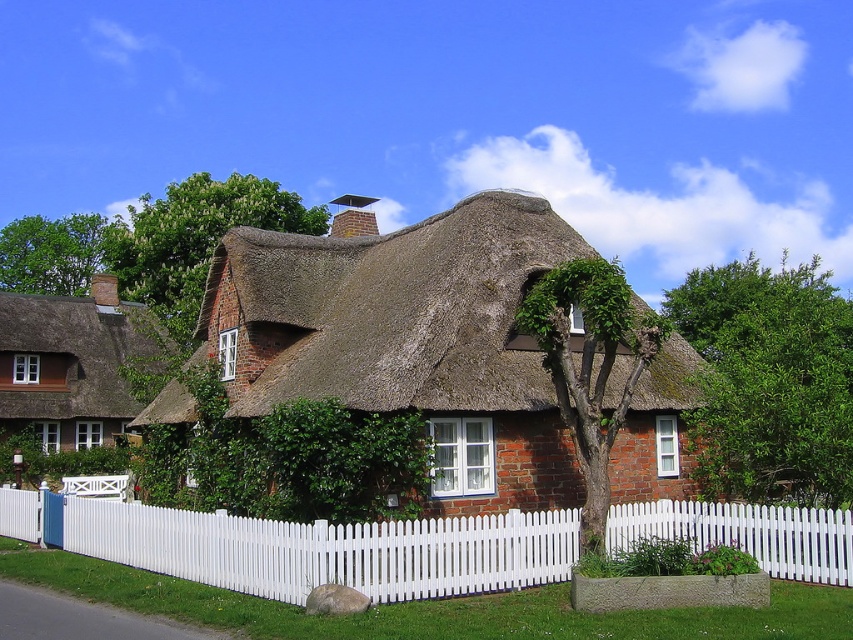
You are standing in front of the thatched cottage and notice the brown thatch roof at center and the white picket fence at center. Which object is located to the right side of the other?

The brown thatch roof at center is positioned on the right side of white picket fence at center.